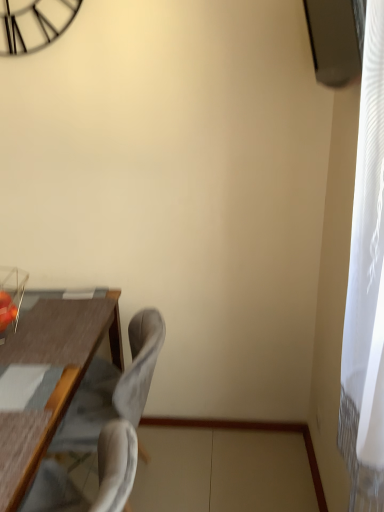
This screenshot has width=384, height=512. Describe the element at coordinates (113, 388) in the screenshot. I see `suede-like gray chair at center-left` at that location.

Locate an element on the screen. The width and height of the screenshot is (384, 512). suede-like gray chair at center-left is located at coordinates (113, 388).

What is the approximate height of gray fabric swivel chair at lower left?

It is 17.20 inches.

Find the location of a particular element. gray fabric swivel chair at lower left is located at coordinates (116, 466).

This screenshot has width=384, height=512. What do you see at coordinates (116, 466) in the screenshot?
I see `gray fabric swivel chair at lower left` at bounding box center [116, 466].

Looking at this image, what is the approximate width of gray fabric swivel chair at lower left?

gray fabric swivel chair at lower left is 18.59 inches in width.

What are the coordinates of `suede-like gray chair at center-left` in the screenshot? It's located at (113, 388).

Which is more to the right, suede-like gray chair at center-left or gray fabric swivel chair at lower left?

From the viewer's perspective, suede-like gray chair at center-left appears more on the right side.

Is the depth of suede-like gray chair at center-left greater than that of gray fabric swivel chair at lower left?

Yes, suede-like gray chair at center-left is further from the viewer.

Is point (119, 377) positioned after point (46, 475)?

That is True.

From the image's perspective, is suede-like gray chair at center-left above or below gray fabric swivel chair at lower left?

suede-like gray chair at center-left is above gray fabric swivel chair at lower left.

From a real-world perspective, is suede-like gray chair at center-left located higher than gray fabric swivel chair at lower left?

No, from a real-world perspective, suede-like gray chair at center-left is not on top of gray fabric swivel chair at lower left.

Between suede-like gray chair at center-left and gray fabric swivel chair at lower left, which one has larger width?

With larger width is suede-like gray chair at center-left.

Who is taller, suede-like gray chair at center-left or gray fabric swivel chair at lower left?

suede-like gray chair at center-left is taller.

Considering the relative sizes of suede-like gray chair at center-left and gray fabric swivel chair at lower left in the image provided, is suede-like gray chair at center-left smaller than gray fabric swivel chair at lower left?

Actually, suede-like gray chair at center-left might be larger than gray fabric swivel chair at lower left.

Is suede-like gray chair at center-left not inside gray fabric swivel chair at lower left?

suede-like gray chair at center-left lies outside gray fabric swivel chair at lower left's area.

Are suede-like gray chair at center-left and gray fabric swivel chair at lower left far apart?

No, suede-like gray chair at center-left is not far away from gray fabric swivel chair at lower left.

Could you tell me if suede-like gray chair at center-left is turned towards gray fabric swivel chair at lower left?

No, suede-like gray chair at center-left is not facing towards gray fabric swivel chair at lower left.

Where is `swivel chair lying on the left of suede-like gray chair at center-left`? swivel chair lying on the left of suede-like gray chair at center-left is located at coordinates (116, 466).

Based on the photo, is gray fabric swivel chair at lower left to the left of suede-like gray chair at center-left from the viewer's perspective?

Yes, gray fabric swivel chair at lower left is to the left of suede-like gray chair at center-left.

Is gray fabric swivel chair at lower left positioned behind suede-like gray chair at center-left?

No, it is in front of suede-like gray chair at center-left.

Considering the positions of points (105, 450) and (40, 495), is point (105, 450) farther from camera compared to point (40, 495)?

No, it is not.

From the image's perspective, is gray fabric swivel chair at lower left over suede-like gray chair at center-left?

Actually, gray fabric swivel chair at lower left appears below suede-like gray chair at center-left in the image.

From a real-world perspective, is gray fabric swivel chair at lower left located beneath suede-like gray chair at center-left?

Actually, gray fabric swivel chair at lower left is physically above suede-like gray chair at center-left in the real world.

Based on the photo, is gray fabric swivel chair at lower left thinner than suede-like gray chair at center-left?

Indeed, gray fabric swivel chair at lower left has a lesser width compared to suede-like gray chair at center-left.

Which of these two, gray fabric swivel chair at lower left or suede-like gray chair at center-left, stands taller?

Standing taller between the two is suede-like gray chair at center-left.

Who is bigger, gray fabric swivel chair at lower left or suede-like gray chair at center-left?

With larger size is suede-like gray chair at center-left.

In the scene shown: Is suede-like gray chair at center-left surrounded by gray fabric swivel chair at lower left?

No, suede-like gray chair at center-left is not surrounded by gray fabric swivel chair at lower left.

Does gray fabric swivel chair at lower left touch suede-like gray chair at center-left?

gray fabric swivel chair at lower left and suede-like gray chair at center-left are not in contact.

Is gray fabric swivel chair at lower left turned away from suede-like gray chair at center-left?

gray fabric swivel chair at lower left does not have its back to suede-like gray chair at center-left.

What's the angular difference between gray fabric swivel chair at lower left and suede-like gray chair at center-left's facing directions?

The angle between the facing direction of gray fabric swivel chair at lower left and the facing direction of suede-like gray chair at center-left is 0.000498 degrees.

This screenshot has height=512, width=384. I want to click on chair behind the gray fabric swivel chair at lower left, so click(x=113, y=388).

What are the coordinates of `chair behind the gray fabric swivel chair at lower left` in the screenshot? It's located at (113, 388).

In the image, there is a gray fabric swivel chair at lower left. Where is `chair above it (from the image's perspective)`? chair above it (from the image's perspective) is located at coordinates (113, 388).